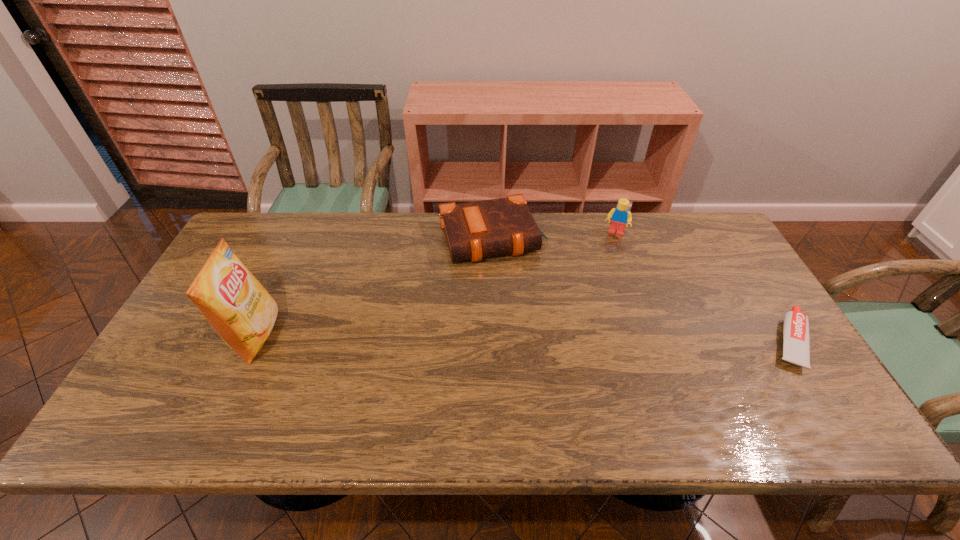
This screenshot has width=960, height=540. I want to click on free space between the toothpaste and the second shortest object, so click(x=640, y=289).

The width and height of the screenshot is (960, 540). I want to click on free spot between the leftmost object and the rightmost object, so click(522, 339).

Find the location of `free space between the third shortest object and the crisp (potato chip)`. free space between the third shortest object and the crisp (potato chip) is located at coordinates 435,285.

The image size is (960, 540). Identify the location of vacant space that is in between the second object from right to left and the shortest object. (702, 287).

You are a GUI agent. You are given a task and a screenshot of the screen. Output one action in this format:
    pyautogui.click(x=<x>, y=<y>)
    Task: Click on the free space between the tallest object and the Lego
    This screenshot has width=960, height=540.
    Given the screenshot: What is the action you would take?
    pyautogui.click(x=435, y=285)

Where is `free space between the Lego and the third tallest object`? The width and height of the screenshot is (960, 540). free space between the Lego and the third tallest object is located at coordinates (553, 235).

Locate an element on the screen. This screenshot has width=960, height=540. vacant space in between the leftmost object and the toothpaste is located at coordinates (522, 339).

Where is `object that is the closest to the third object from right to left`? The width and height of the screenshot is (960, 540). object that is the closest to the third object from right to left is located at coordinates (619, 216).

Where is `object that can be found as the closest to the rightmost object`? object that can be found as the closest to the rightmost object is located at coordinates (619, 216).

I want to click on vacant area in the image that satisfies the following two spatial constraints: 1. on the back side of the Bible; 2. on the left side of the second tallest object, so click(492, 233).